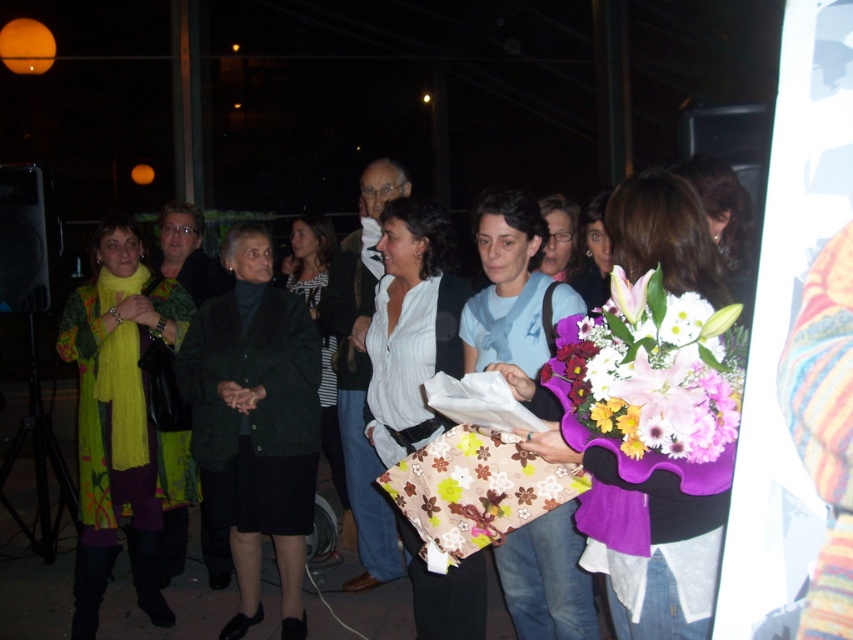
You are organizing a clothing donation drive and need to determine which item takes up more space in the donation box. Based on the image, which clothing item between the green knitted sweater at left and the dark green fabric coat at center has a greater width?

The green knitted sweater at left has a greater width than the dark green fabric coat at center, as stated in the description that the sweater surpasses the coat in width.